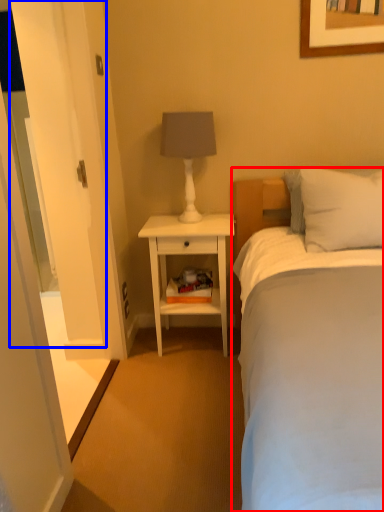
Question: Which object appears closest to the camera in this image, bed (highlighted by a red box) or glass door (highlighted by a blue box)?

Choices:
 (A) bed
 (B) glass door

Answer: (A)